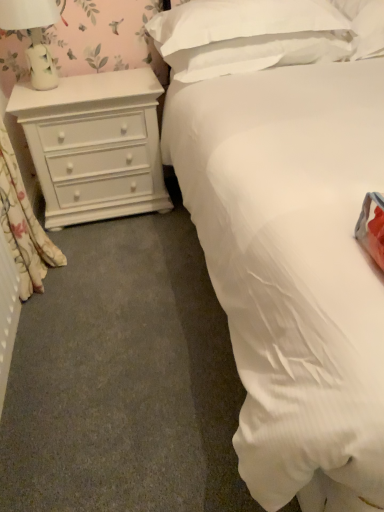
Image resolution: width=384 pixels, height=512 pixels. I want to click on free location in front of white ceramic lamp at upper left, so click(45, 98).